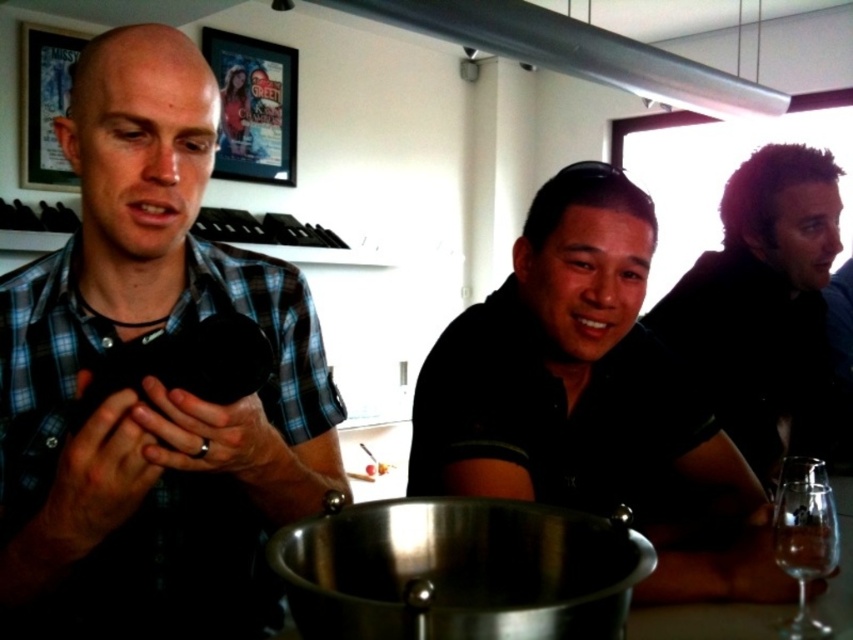
You are at a dinner party and want to pour wine into the taller of the two wine glasses at the lower right. Which glass should you choose between the clear glass wine glass at lower right and the transparent glass wine glass at lower right?

The transparent glass wine glass at lower right is taller than the clear glass wine glass at lower right, so you should choose the transparent glass wine glass at lower right.

You are standing in front of the table with the metallic bowl. You want to hand the metallic bowl to the person wearing the blue plaid shirt at left. Can you reach them without moving your position?

The blue plaid shirt at left and viewer are 21.83 inches apart from each other. Since the distance is relatively close, you can likely reach the person wearing the blue plaid shirt at left without moving your position.

You are a fashion designer observing the scene and want to create a new outfit for the blue plaid shirt at left and the black matte shirt at center. Which shirt requires a wider fabric when making the sleeves?

The black matte shirt at center requires wider fabric for the sleeves since its width is greater than the blue plaid shirt at left.